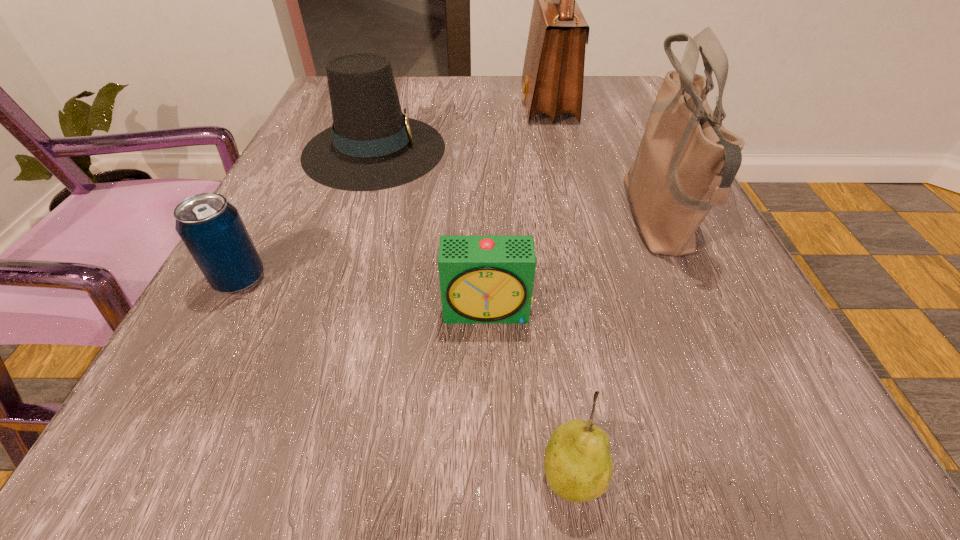
Identify the location of free space located 0.350m on the front-facing side of the right shoulder bag. (413, 219).

Locate an element on the screen. This screenshot has height=540, width=960. free spot located 0.180m on the front-facing side of the right shoulder bag is located at coordinates (516, 219).

Where is `vacant position located on the front-facing side of the right shoulder bag`? vacant position located on the front-facing side of the right shoulder bag is located at coordinates (492, 219).

The image size is (960, 540). I want to click on free location located 0.370m on the front-facing side of the third tallest object, so click(631, 149).

This screenshot has width=960, height=540. I want to click on vacant space located 0.160m on the right of the soda can, so click(x=377, y=280).

Image resolution: width=960 pixels, height=540 pixels. I want to click on vacant space situated on the front-facing side of the alarm clock, so tap(491, 457).

Locate an element on the screen. vacant space located 0.080m on the back of the pear is located at coordinates (557, 374).

I want to click on shoulder bag located at the far edge, so click(553, 72).

The image size is (960, 540). What are the coordinates of `hat located at the far edge` in the screenshot? It's located at coord(372,145).

This screenshot has height=540, width=960. In order to click on object present at the near edge in this screenshot , I will do `click(578, 465)`.